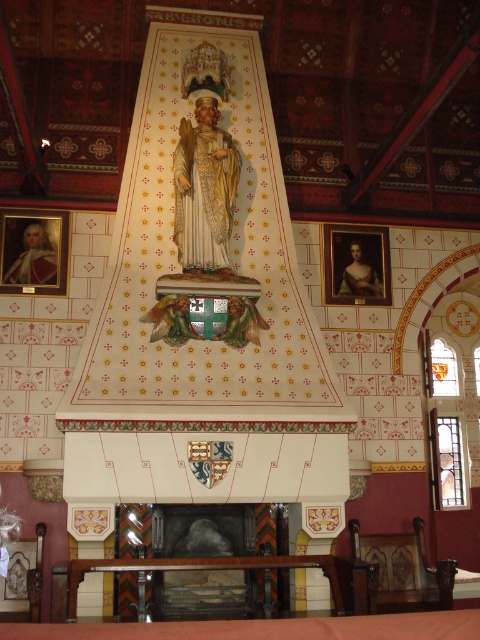
Question: Is matte gold frame at upper left smaller than matte gold portrait at upper right?

Choices:
 (A) yes
 (B) no

Answer: (A)

Question: Which object appears farthest from the camera in this image?

Choices:
 (A) matte gold frame at upper left
 (B) matte gold portrait at upper right
 (C) dark gray stone fireplace at center

Answer: (B)

Question: Is matte gold frame at upper left below matte gold portrait at upper right?

Choices:
 (A) yes
 (B) no

Answer: (B)

Question: Estimate the real-world distances between objects in this image. Which object is farther from the matte gold frame at upper left?

Choices:
 (A) dark gray stone fireplace at center
 (B) matte gold portrait at upper right

Answer: (A)

Question: Is dark gray stone fireplace at center bigger than matte gold portrait at upper right?

Choices:
 (A) yes
 (B) no

Answer: (B)

Question: Which of the following is the closest to the observer?

Choices:
 (A) matte gold frame at upper left
 (B) dark gray stone fireplace at center

Answer: (B)